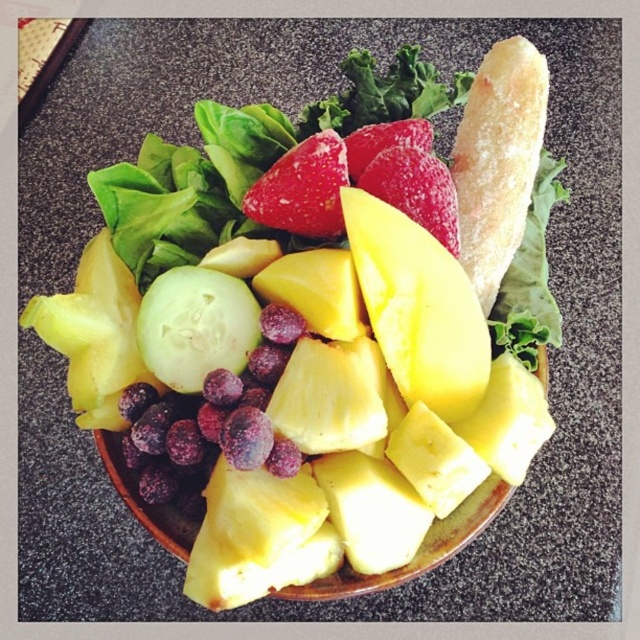
You are holding a camera and want to take a photo of the fruit platter. The camera is currently positioned at point (371, 296). The recommended distance for taking a clear photo is 25 inches. Is the camera too close or too far from the fruit platter?

The camera is positioned at point (371, 296) and is 27.94 inches away from the fruit platter. Since the recommended distance is 25 inches, the camera is slightly too far to take a clear photo. Move it closer by about 3 inches to achieve the optimal distance.

You are a food stylist arranging this fruit platter. You need to ensure that the yellow juicy pineapple at center and the golden crusty bread at upper right fit within the plate. Which object has a greater width?

The yellow juicy pineapple at center has a greater width than the golden crusty bread at upper right according to the description.

You are arranging a fruit platter and want to place a yellow juicy pineapple at center and a shiny red strawberry at center. According to the image, which fruit is positioned lower on the platter?

The yellow juicy pineapple at center is located below the shiny red strawberry at center, so the pineapple is positioned lower on the platter.